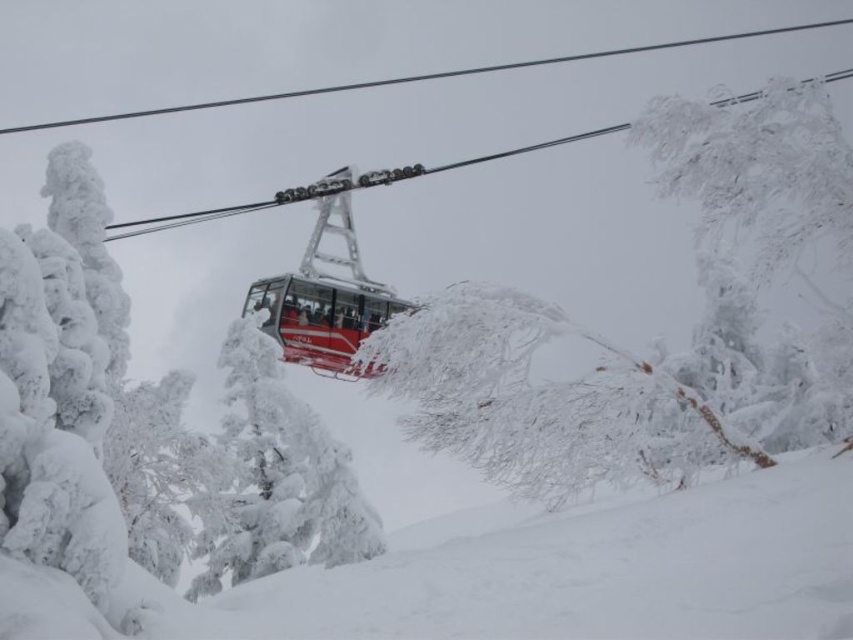
Question: Which point is closer to the camera?

Choices:
 (A) metallic red cable car at center
 (B) frosted glass tree at upper right

Answer: (B)

Question: Can you confirm if frosted glass tree at upper right is smaller than white frosty tree at center?

Choices:
 (A) yes
 (B) no

Answer: (B)

Question: Which point is closer to the camera taking this photo?

Choices:
 (A) (811, 166)
 (B) (363, 321)
 (C) (296, 493)

Answer: (A)

Question: Can you confirm if frosted glass tree at upper right is positioned above metallic red cable car at center?

Choices:
 (A) no
 (B) yes

Answer: (B)

Question: Is frosted glass tree at upper right closer to the viewer compared to metallic red cable car at center?

Choices:
 (A) no
 (B) yes

Answer: (B)

Question: Which of the following is the farthest from the observer?

Choices:
 (A) (x=354, y=323)
 (B) (x=782, y=248)
 (C) (x=318, y=550)

Answer: (A)